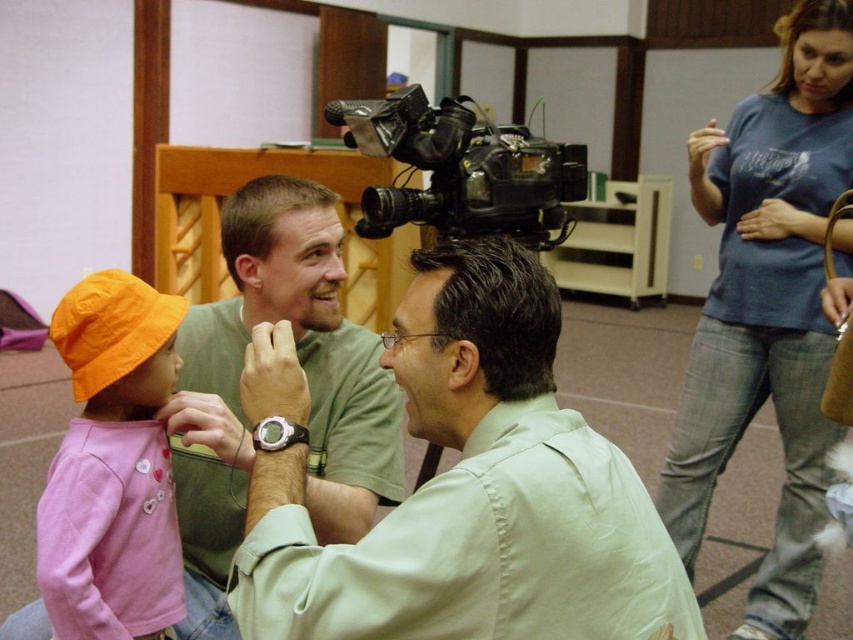
Can you confirm if light green shirt at center is positioned above blue cotton shirt at upper right?

No.

Who is more forward, (473,593) or (815,332)?

Point (473,593) is in front.

I want to click on light green shirt at center, so click(473, 492).

Is matte green shirt at center wider than black plastic video camera at upper center?

In fact, matte green shirt at center might be narrower than black plastic video camera at upper center.

Image resolution: width=853 pixels, height=640 pixels. Find the location of `matte green shirt at center`. matte green shirt at center is located at coordinates (308, 387).

Does point (207, 358) come in front of point (550, 180)?

Yes, it is.

Where is `matte green shirt at center`? The height and width of the screenshot is (640, 853). matte green shirt at center is located at coordinates (308, 387).

Does light green shirt at center come in front of matte green shirt at center?

That is True.

Can you confirm if light green shirt at center is shorter than matte green shirt at center?

Correct, light green shirt at center is not as tall as matte green shirt at center.

The width and height of the screenshot is (853, 640). I want to click on light green shirt at center, so click(x=473, y=492).